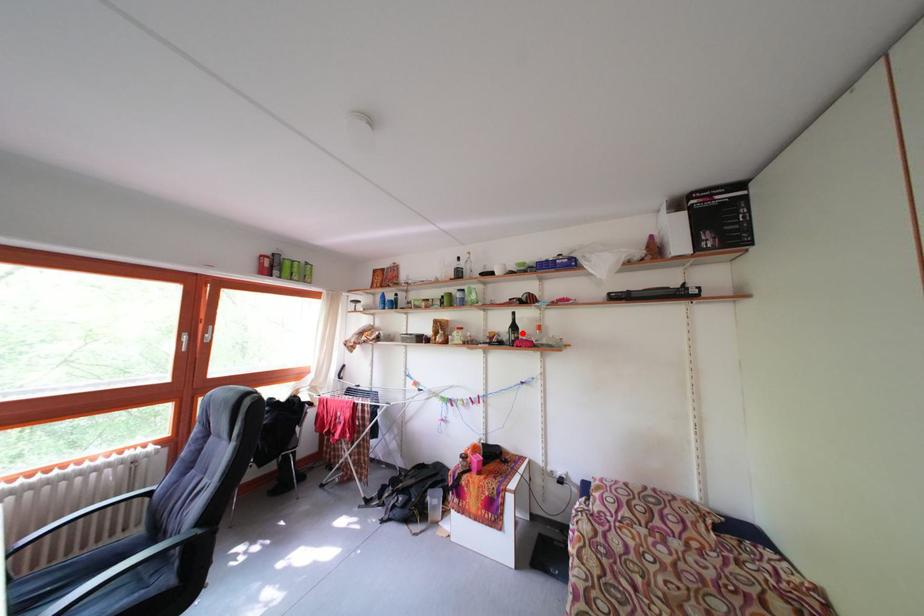
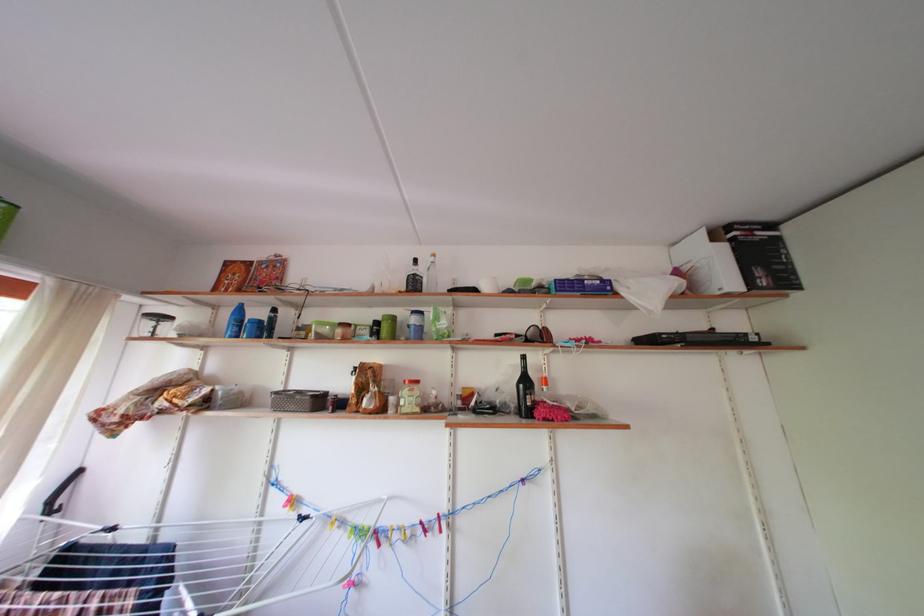
Where in the second image is the point corresponding to the highlighted location from the first image?

(533, 387)